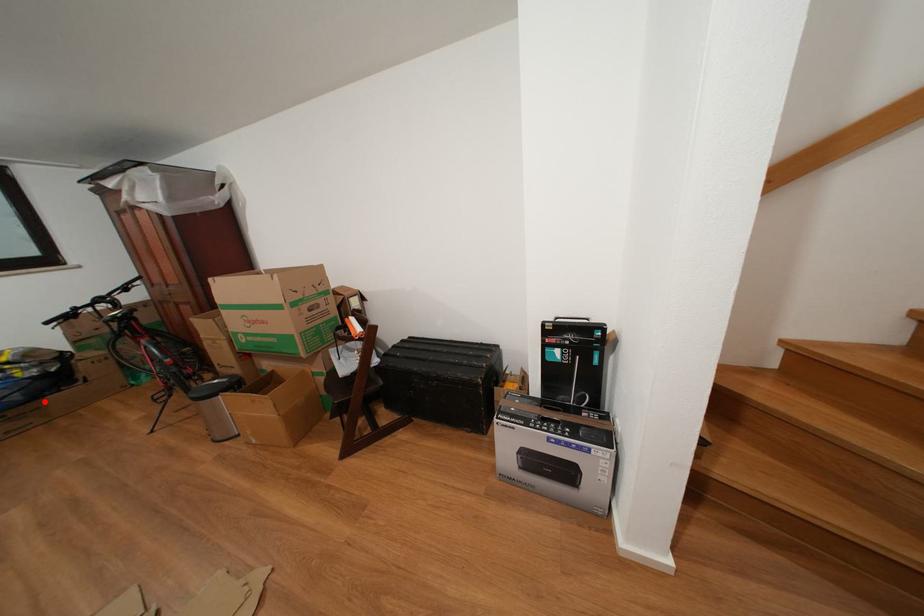
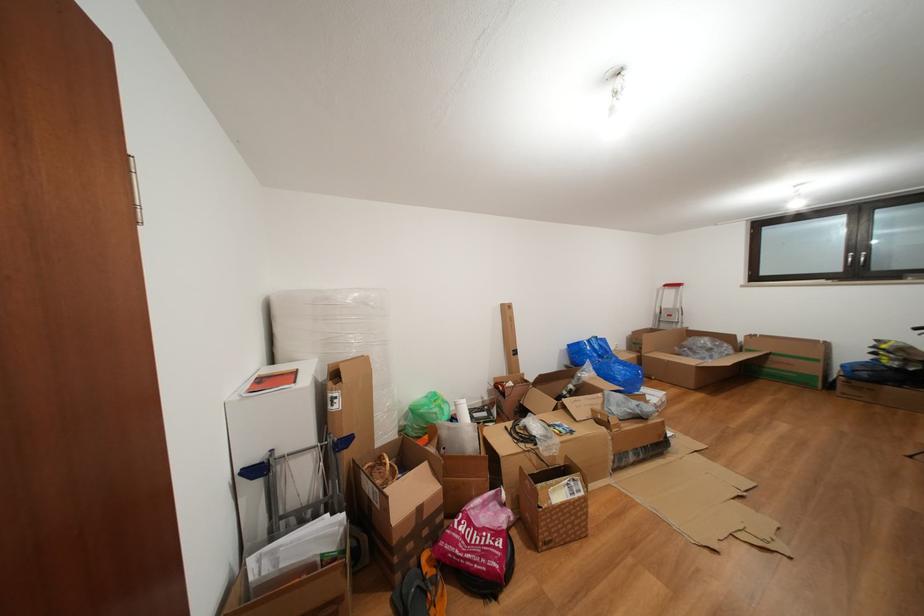
Question: I am providing you with two images of the same scene from different viewpoints. Image1 has a red point marked. In image2, the corresponding 3D location appears at what relative position? Reply with the corresponding letter.

Choices:
 (A) Closer
 (B) Farther

Answer: (B)